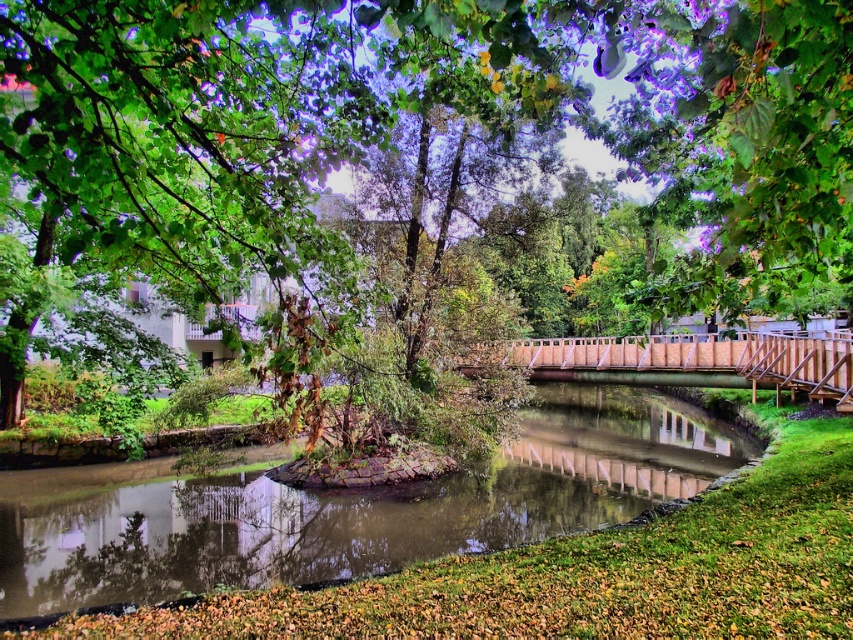
Based on the photo, you are standing on the bridge that crosses the river and want to observe the green leafy tree at center and the greenish murky water at center. Which object is closer to your eyes?

The green leafy tree at center is above the greenish murky water at center, so the green leafy tree at center is closer to your eyes.

You are standing at the center of the river and see the point marked at coordinates (418, 173). What object is located at that point?

The point at coordinates (418, 173) corresponds to the green leafy tree at center.

You are a hiker who wants to cross the river using the wooden bridge at center. However, you notice the greenish murky water at center. Can you safely cross the bridge without getting your feet wet?

The greenish murky water at center is not as tall as the wooden bridge at center, so yes, you can safely cross the bridge without getting your feet wet because the bridge is higher than the water level.